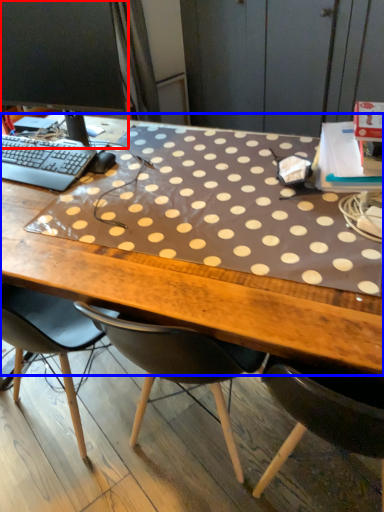
Question: Which point is further to the camera, computer monitor (highlighted by a red box) or desk (highlighted by a blue box)?

Choices:
 (A) computer monitor
 (B) desk

Answer: (A)